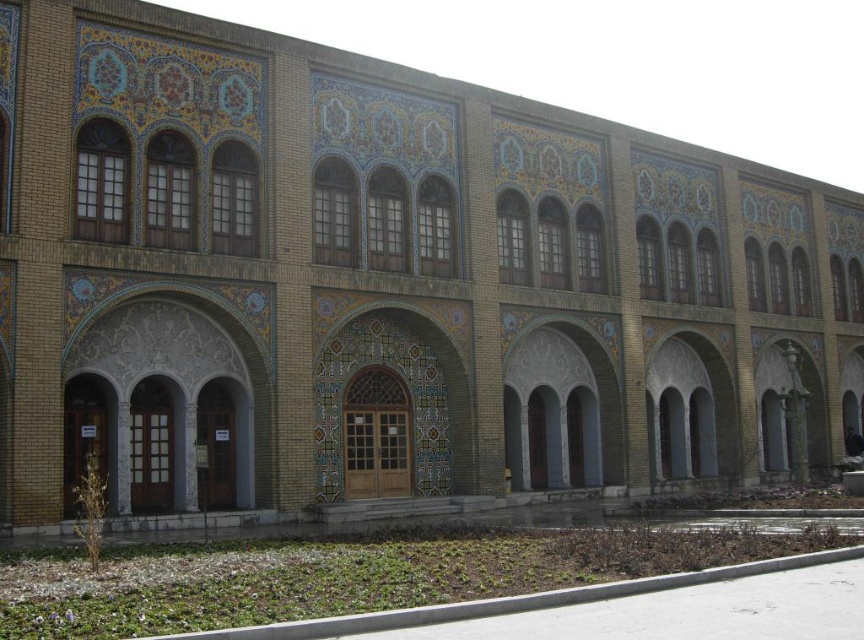
How distant is white stone archway at center from matte stone archway at center?

white stone archway at center is 19.13 meters away from matte stone archway at center.

Is white stone archway at center wider than matte stone archway at center?

No, white stone archway at center is not wider than matte stone archway at center.

Between point (205, 317) and point (556, 483), which one is positioned behind?

The point (556, 483) is behind.

This screenshot has width=864, height=640. What are the coordinates of `white stone archway at center` in the screenshot? It's located at [163, 371].

Does matte stone archway at center appear on the left side of gray stone archway at center?

Correct, you'll find matte stone archway at center to the left of gray stone archway at center.

Measure the distance between matte stone archway at center and gray stone archway at center.

matte stone archway at center and gray stone archway at center are 8.04 meters apart from each other.

The height and width of the screenshot is (640, 864). What do you see at coordinates (561, 410) in the screenshot? I see `matte stone archway at center` at bounding box center [561, 410].

Locate an element on the screen. Image resolution: width=864 pixels, height=640 pixels. matte stone archway at center is located at coordinates (561, 410).

Is point (154, 348) farther from viewer compared to point (702, 436)?

No.

Between point (258, 294) and point (693, 337), which one is positioned in front?

Point (258, 294)

Describe the element at coordinates (163, 371) in the screenshot. The width and height of the screenshot is (864, 640). I see `white stone archway at center` at that location.

Find the location of `white stone archway at center`. white stone archway at center is located at coordinates (163, 371).